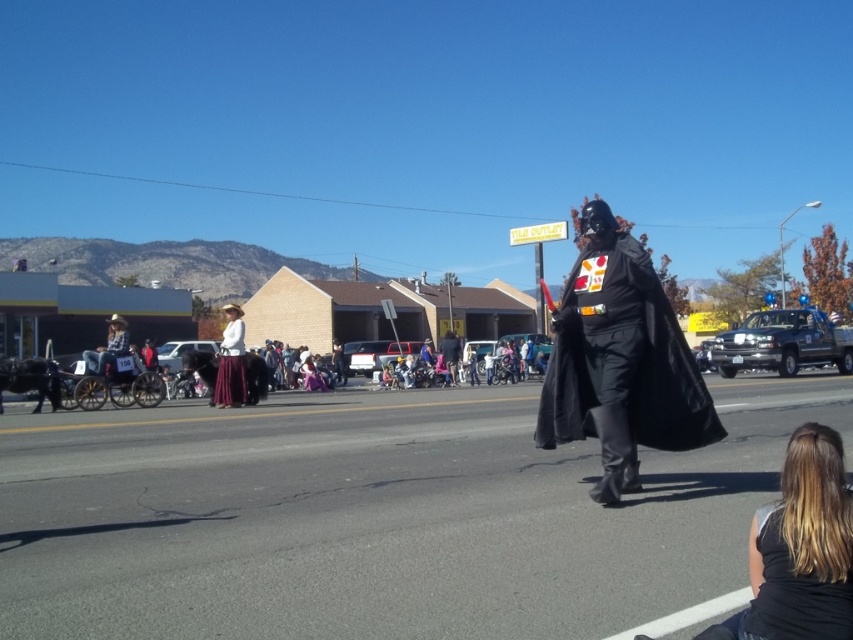
Does black matte cape at center have a smaller size compared to matte black costume at center?

Correct, black matte cape at center occupies less space than matte black costume at center.

Describe the element at coordinates (630, 355) in the screenshot. This screenshot has width=853, height=640. I see `black matte cape at center` at that location.

What are the coordinates of `black matte cape at center` in the screenshot? It's located at (630, 355).

Looking at this image, can you confirm if blonde hair at lower right is positioned to the right of matte white shirt at center?

Correct, you'll find blonde hair at lower right to the right of matte white shirt at center.

Is blonde hair at lower right taller than matte white shirt at center?

No.

Which is behind, point (743, 611) or point (224, 381)?

Point (224, 381)

The width and height of the screenshot is (853, 640). I want to click on blonde hair at lower right, so click(799, 548).

Between matte white shirt at center and matte black costume at center, which one is positioned lower?

matte black costume at center is lower down.

Consider the image. Who is more distant from viewer, [231,381] or [151,355]?

The point [151,355] is behind.

Identify the location of matte white shirt at center. This screenshot has height=640, width=853. (231, 362).